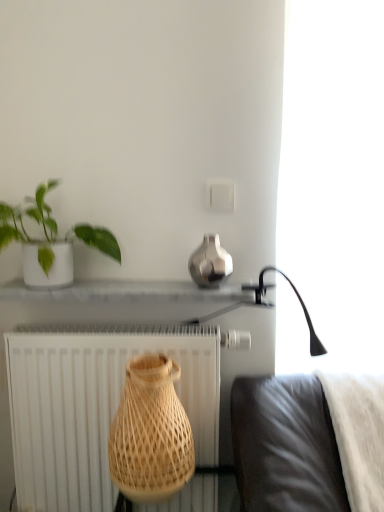
What is the approximate width of shiny metallic vase at center, marked as the second vase in a bottom-to-top arrangement?

shiny metallic vase at center, marked as the second vase in a bottom-to-top arrangement, is 6.50 inches wide.

Consider the image. What is the approximate width of white fluffy blanket at lower right?

white fluffy blanket at lower right is 15.22 inches wide.

Image resolution: width=384 pixels, height=512 pixels. Identify the location of white fluffy blanket at lower right. (358, 434).

Image resolution: width=384 pixels, height=512 pixels. In order to click on natural wood vase at center, which is the first vase in bottom-to-top order in this screenshot , I will do `click(150, 433)`.

Find the location of a particular element. The image size is (384, 512). white glossy shelf at center is located at coordinates (128, 292).

Based on the photo, does green matte plant at upper left have a greater width compared to natural wood vase at center, which is the first vase in bottom-to-top order?

No, green matte plant at upper left is not wider than natural wood vase at center, which is the first vase in bottom-to-top order.

From the image's perspective, is green matte plant at upper left beneath natural wood vase at center, which is the first vase in bottom-to-top order?

No.

Does green matte plant at upper left have a lesser height compared to natural wood vase at center, which ranks as the second vase in top-to-bottom order?

Indeed, green matte plant at upper left has a lesser height compared to natural wood vase at center, which ranks as the second vase in top-to-bottom order.

Could shiny metallic vase at center, marked as the second vase in a bottom-to-top arrangement, be considered to be inside white fluffy blanket at lower right?

Definitely not — shiny metallic vase at center, marked as the second vase in a bottom-to-top arrangement, is not inside white fluffy blanket at lower right.

Is white fluffy blanket at lower right in front of or behind shiny metallic vase at center, acting as the 1th vase starting from the right, in the image?

white fluffy blanket at lower right is in front of shiny metallic vase at center, acting as the 1th vase starting from the right.

In the scene shown: Which is more to the left, white fluffy blanket at lower right or shiny metallic vase at center, acting as the 1th vase starting from the right?

From the viewer's perspective, shiny metallic vase at center, acting as the 1th vase starting from the right, appears more on the left side.

Starting from the white fluffy blanket at lower right, which vase is the 2nd one behind? Please provide its 2D coordinates.

[(210, 263)]

Is point (214, 252) farther from viewer compared to point (355, 380)?

That is False.

Considering the positions of objects shiny metallic vase at center, positioned as the 2th vase in left-to-right order, and white fluffy blanket at lower right in the image provided, who is in front, shiny metallic vase at center, positioned as the 2th vase in left-to-right order, or white fluffy blanket at lower right?

white fluffy blanket at lower right.

Does shiny metallic vase at center, acting as the 1th vase starting from the right, turn towards white fluffy blanket at lower right?

No, shiny metallic vase at center, acting as the 1th vase starting from the right, is not turned towards white fluffy blanket at lower right.

The height and width of the screenshot is (512, 384). Find the location of `the 2nd vase behind the white fluffy blanket at lower right`. the 2nd vase behind the white fluffy blanket at lower right is located at coordinates (210, 263).

Is white fluffy blanket at lower right bigger or smaller than natural wood vase at center, which ranks as the first vase in left-to-right order?

white fluffy blanket at lower right is bigger than natural wood vase at center, which ranks as the first vase in left-to-right order.

Which is less distant, (360,503) or (186,471)?

Point (360,503) is farther from the camera than point (186,471).

Starting from the white fluffy blanket at lower right, which vase is the 2nd one to the left? Please provide its 2D coordinates.

[(150, 433)]

Considering the relative positions of white fluffy blanket at lower right and natural wood vase at center, which ranks as the second vase in top-to-bottom order, in the image provided, is white fluffy blanket at lower right to the left of natural wood vase at center, which ranks as the second vase in top-to-bottom order, from the viewer's perspective?

In fact, white fluffy blanket at lower right is to the right of natural wood vase at center, which ranks as the second vase in top-to-bottom order.

From a real-world perspective, does natural wood vase at center, which ranks as the first vase in left-to-right order, sit lower than white fluffy blanket at lower right?

Incorrect, from a real-world perspective, natural wood vase at center, which ranks as the first vase in left-to-right order, is higher than white fluffy blanket at lower right.

From the image's perspective, between natural wood vase at center, placed as the second vase when sorted from right to left, and white fluffy blanket at lower right, who is located below?

white fluffy blanket at lower right, from the image's perspective.

In terms of width, does natural wood vase at center, which is the first vase in bottom-to-top order, look wider or thinner when compared to white fluffy blanket at lower right?

Considering their sizes, natural wood vase at center, which is the first vase in bottom-to-top order, looks slimmer than white fluffy blanket at lower right.

Is natural wood vase at center, placed as the second vase when sorted from right to left, behind white glossy shelf at center?

No, it is not.

From the image's perspective, is natural wood vase at center, which is the first vase in bottom-to-top order, above or below white glossy shelf at center?

natural wood vase at center, which is the first vase in bottom-to-top order, is situated lower than white glossy shelf at center in the image.

Does natural wood vase at center, placed as the second vase when sorted from right to left, have a greater height compared to white glossy shelf at center?

Yes.

From a real-world perspective, which object rests below the other?

natural wood vase at center, which ranks as the second vase in top-to-bottom order.

Is shiny metallic vase at center, positioned as the 2th vase in left-to-right order, bigger than natural wood vase at center, which is the first vase in bottom-to-top order?

Actually, shiny metallic vase at center, positioned as the 2th vase in left-to-right order, might be smaller than natural wood vase at center, which is the first vase in bottom-to-top order.

Is shiny metallic vase at center, acting as the 1th vase starting from the right, wider or thinner than natural wood vase at center, which ranks as the first vase in left-to-right order?

In the image, shiny metallic vase at center, acting as the 1th vase starting from the right, appears to be more narrow than natural wood vase at center, which ranks as the first vase in left-to-right order.

Find the location of `vase above the natural wood vase at center, which is the first vase in bottom-to-top order (from a real-world perspective)`. vase above the natural wood vase at center, which is the first vase in bottom-to-top order (from a real-world perspective) is located at coordinates (210, 263).

Is shiny metallic vase at center, acting as the 1th vase starting from the right, behind natural wood vase at center, which ranks as the first vase in left-to-right order?

Yes.

The width and height of the screenshot is (384, 512). Identify the location of houseplant that is above the natural wood vase at center, which ranks as the second vase in top-to-bottom order (from a real-world perspective). (50, 240).

In order to click on blanket below the shiny metallic vase at center, positioned as the 2th vase in left-to-right order (from the image's perspective) in this screenshot , I will do `click(358, 434)`.

When comparing their distances from white textured radiator at lower left, does white glossy shelf at center or shiny metallic vase at center, acting as the 1th vase starting from the right, seem closer?

white glossy shelf at center is positioned closer to the anchor white textured radiator at lower left.

When comparing their distances from green matte plant at upper left, does shiny metallic vase at center, positioned as the 2th vase in left-to-right order, or white textured radiator at lower left seem closer?

Based on the image, white textured radiator at lower left appears to be nearer to green matte plant at upper left.

Estimate the real-world distances between objects in this image. Which object is further from shiny metallic vase at center, marked as the second vase in a bottom-to-top arrangement, white fluffy blanket at lower right or green matte plant at upper left?

Based on the image, white fluffy blanket at lower right appears to be further to shiny metallic vase at center, marked as the second vase in a bottom-to-top arrangement.

From the image, which object appears to be farther from white fluffy blanket at lower right, white textured radiator at lower left or shiny metallic vase at center, positioned as the 2th vase in left-to-right order?

white textured radiator at lower left is further to white fluffy blanket at lower right.

Based on their spatial positions, is white glossy shelf at center or shiny metallic vase at center, acting as the 1th vase starting from the right, closer to natural wood vase at center, which is the first vase in bottom-to-top order?

The object closer to natural wood vase at center, which is the first vase in bottom-to-top order, is white glossy shelf at center.

Consider the image. Considering their positions, is white textured radiator at lower left positioned closer to white glossy shelf at center than green matte plant at upper left?

The object closer to white glossy shelf at center is green matte plant at upper left.

Estimate the real-world distances between objects in this image. Which object is further from white glossy shelf at center, shiny metallic vase at center, positioned as the 2th vase in left-to-right order, or white fluffy blanket at lower right?

white fluffy blanket at lower right.

From the image, which object appears to be nearer to white glossy shelf at center, shiny metallic vase at center, acting as the 1th vase starting from the right, or green matte plant at upper left?

green matte plant at upper left lies closer to white glossy shelf at center than the other object.

I want to click on vase between green matte plant at upper left and natural wood vase at center, which is the first vase in bottom-to-top order, in the vertical direction, so click(210, 263).

Where is `window sill between shiny metallic vase at center, the 1th vase when ordered from top to bottom, and natural wood vase at center, which ranks as the second vase in top-to-bottom order, in the up-down direction`? This screenshot has width=384, height=512. window sill between shiny metallic vase at center, the 1th vase when ordered from top to bottom, and natural wood vase at center, which ranks as the second vase in top-to-bottom order, in the up-down direction is located at coordinates (128, 292).

At what (x,y) coordinates should I click in order to perform the action: click on vase between shiny metallic vase at center, acting as the 1th vase starting from the right, and white textured radiator at lower left from top to bottom. Please return your answer as a coordinate pair (x, y). The height and width of the screenshot is (512, 384). Looking at the image, I should click on (150, 433).

Where is `window sill located between green matte plant at upper left and white fluffy blanket at lower right in the left-right direction`? The width and height of the screenshot is (384, 512). window sill located between green matte plant at upper left and white fluffy blanket at lower right in the left-right direction is located at coordinates (128, 292).